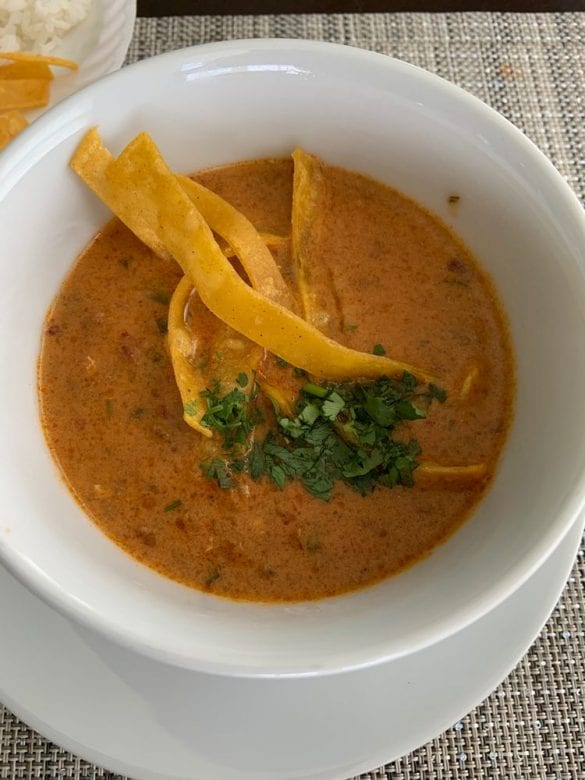
Where is `table`? This screenshot has width=585, height=780. table is located at coordinates (164, 5).